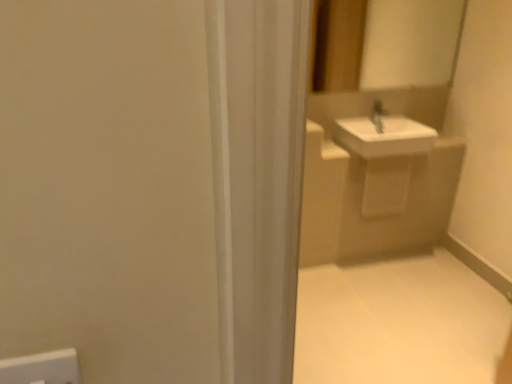
Question: Considering the positions of point (333, 291) and point (397, 134), is point (333, 291) closer or farther from the camera than point (397, 134)?

Choices:
 (A) closer
 (B) farther

Answer: (B)

Question: Considering the positions of white tile floor at lower right and white glossy sink at upper right in the image, is white tile floor at lower right taller or shorter than white glossy sink at upper right?

Choices:
 (A) tall
 (B) short

Answer: (B)

Question: Estimate the real-world distances between objects in this image. Which object is farther from the white glossy mirror at upper center?

Choices:
 (A) white tile floor at lower right
 (B) white glossy sink at upper right

Answer: (A)

Question: Which of these objects is positioned farthest from the white glossy sink at upper right?

Choices:
 (A) white glossy mirror at upper center
 (B) white tile floor at lower right

Answer: (B)